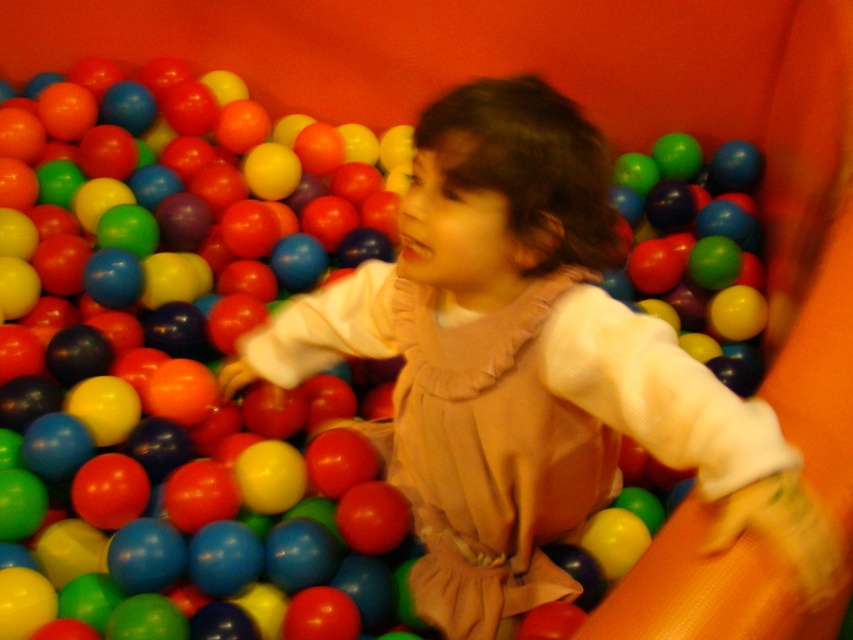
Which of these two, matte plastic ball at center or matte beige dress at center, stands taller?

Standing taller between the two is matte plastic ball at center.

Can you confirm if matte plastic ball at center is positioned to the left of matte beige dress at center?

Correct, you'll find matte plastic ball at center to the left of matte beige dress at center.

Is point (24, 180) behind point (488, 568)?

Yes, point (24, 180) is behind point (488, 568).

In order to click on matte plastic ball at center in this screenshot , I will do `click(180, 371)`.

Is matte beige dress at center above orange rubber slide at right?

Yes, matte beige dress at center is above orange rubber slide at right.

Measure the distance between matte beige dress at center and camera.

They are 37.06 inches apart.

The image size is (853, 640). Find the location of `matte beige dress at center`. matte beige dress at center is located at coordinates (527, 368).

Is matte plastic ball at center smaller than matte plastic ball at upper center?

Actually, matte plastic ball at center might be larger than matte plastic ball at upper center.

Who is shorter, matte plastic ball at center or matte plastic ball at upper center?

matte plastic ball at upper center is shorter.

Is point (383, 595) positioned before point (656, 257)?

Yes, it is.

The width and height of the screenshot is (853, 640). I want to click on matte plastic ball at center, so click(x=180, y=371).